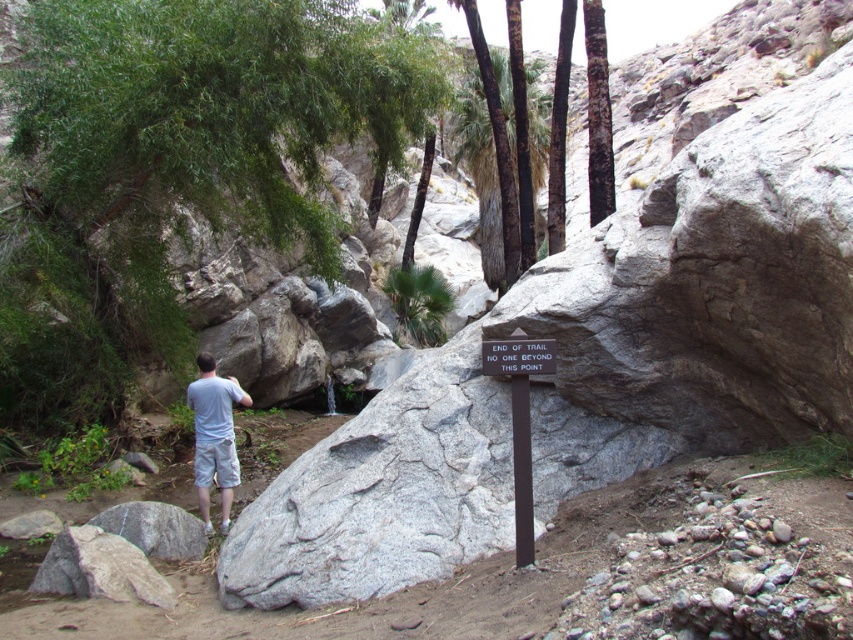
Which is behind, point (509, 385) or point (553, 154)?

The point (553, 154) is more distant.

Who is higher up, black metal sign at center or brown rough bark tree at upper center?

brown rough bark tree at upper center is higher up.

Between point (532, 353) and point (561, 160), which one is positioned in front?

Positioned in front is point (532, 353).

This screenshot has height=640, width=853. Identify the location of black metal sign at center. (520, 420).

Does black metal sign at center have a greater height compared to smooth dark brown tree trunk at center?

Incorrect, black metal sign at center's height is not larger of smooth dark brown tree trunk at center's.

Does black metal sign at center lie in front of smooth dark brown tree trunk at center?

That is True.

Who is more forward, (519, 330) or (595, 125)?

Point (519, 330)

I want to click on black metal sign at center, so click(520, 420).

This screenshot has height=640, width=853. What do you see at coordinates (171, 168) in the screenshot? I see `green leafy tree at upper left` at bounding box center [171, 168].

Where is `green leafy tree at upper left`? This screenshot has height=640, width=853. green leafy tree at upper left is located at coordinates (171, 168).